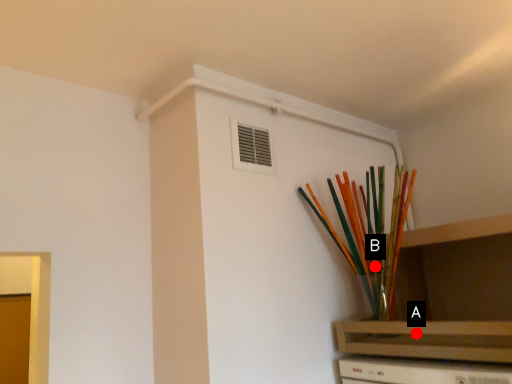
Question: Two points are circled on the image, labeled by A and B beside each circle. Which point is farther to the camera?

Choices:
 (A) A is further
 (B) B is further

Answer: (B)